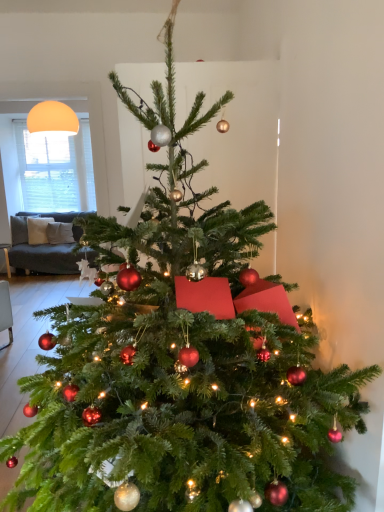
Question: From the image's perspective, is white matte window screen at upper left on top of matte orange sphere at upper left?

Choices:
 (A) yes
 (B) no

Answer: (B)

Question: From a real-world perspective, is white matte window screen at upper left over matte orange sphere at upper left?

Choices:
 (A) yes
 (B) no

Answer: (B)

Question: Is white matte window screen at upper left to the left of matte orange sphere at upper left from the viewer's perspective?

Choices:
 (A) no
 (B) yes

Answer: (B)

Question: Is white matte window screen at upper left completely or partially outside of matte orange sphere at upper left?

Choices:
 (A) yes
 (B) no

Answer: (A)

Question: From the image's perspective, is white matte window screen at upper left located beneath matte orange sphere at upper left?

Choices:
 (A) no
 (B) yes

Answer: (B)

Question: Is white matte window screen at upper left not close to matte orange sphere at upper left?

Choices:
 (A) no
 (B) yes

Answer: (A)

Question: From a real-world perspective, is matte orange sphere at upper left under white matte window screen at upper left?

Choices:
 (A) yes
 (B) no

Answer: (B)

Question: Is matte orange sphere at upper left located outside white matte window screen at upper left?

Choices:
 (A) no
 (B) yes

Answer: (B)

Question: From the image's perspective, would you say matte orange sphere at upper left is shown under white matte window screen at upper left?

Choices:
 (A) no
 (B) yes

Answer: (A)

Question: Is the surface of matte orange sphere at upper left in direct contact with white matte window screen at upper left?

Choices:
 (A) yes
 (B) no

Answer: (B)

Question: Is matte orange sphere at upper left behind white matte window screen at upper left?

Choices:
 (A) yes
 (B) no

Answer: (B)

Question: Does matte orange sphere at upper left have a lesser height compared to white matte window screen at upper left?

Choices:
 (A) yes
 (B) no

Answer: (A)

Question: Is matte orange sphere at upper left taller or shorter than white matte window screen at upper left?

Choices:
 (A) short
 (B) tall

Answer: (A)